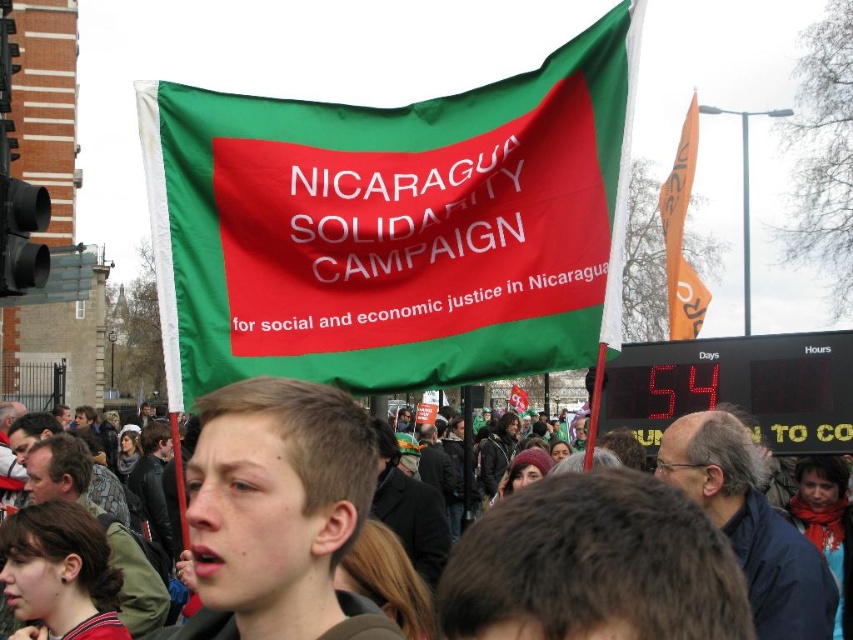
Question: Can you confirm if green fabric flag at center is bigger than smooth brown hair at center?

Choices:
 (A) yes
 (B) no

Answer: (B)

Question: Does green fabric flag at center have a greater width compared to green fabric flag at upper center?

Choices:
 (A) no
 (B) yes

Answer: (B)

Question: Which point is farther to the camera?

Choices:
 (A) green fabric flag at center
 (B) green fabric flag at upper center
 (C) smooth brown hair at center
 (D) orange fabric flag at upper right

Answer: (B)

Question: Which point is closer to the camera?

Choices:
 (A) green fabric flag at center
 (B) orange fabric flag at upper right
 (C) smooth brown hair at center

Answer: (C)

Question: Does green fabric flag at center appear on the left side of green fabric flag at upper center?

Choices:
 (A) no
 (B) yes

Answer: (B)

Question: Which point is closer to the camera?

Choices:
 (A) smooth brown hair at center
 (B) green fabric flag at upper center
 (C) green fabric flag at center

Answer: (A)